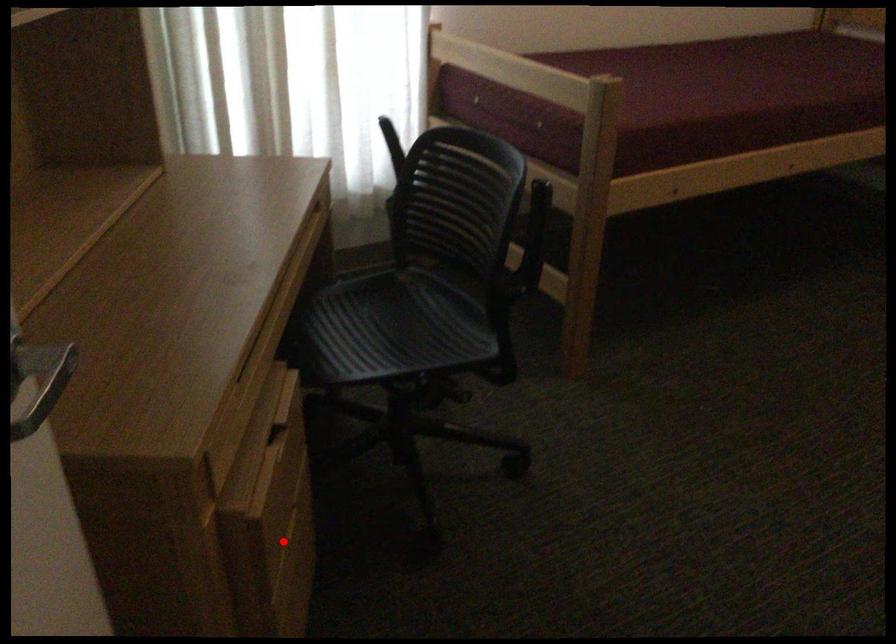
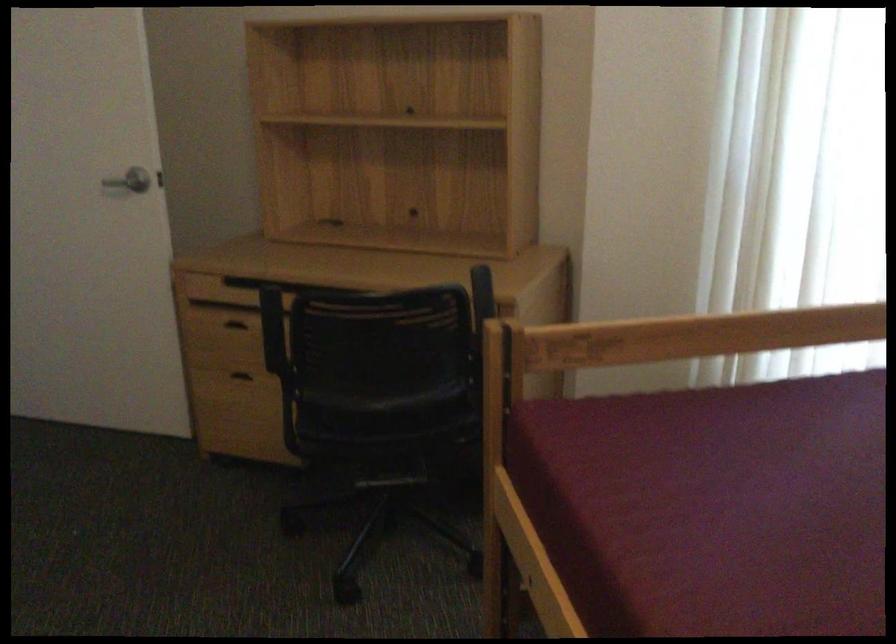
Question: I am providing you with two images of the same scene from different viewpoints. In image1, a red point is highlighted. Considering the same 3D point in image2, which of the following is correct?

Choices:
 (A) It is closer
 (B) It is farther

Answer: (B)